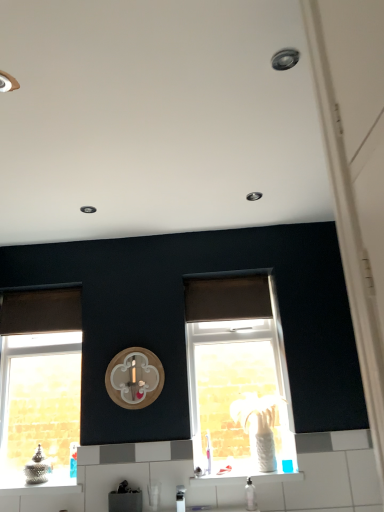
Locate an element on the screen. This screenshot has width=384, height=512. brown matte curtain at center, the 2th curtain from the left is located at coordinates (226, 297).

Describe the element at coordinates (40, 310) in the screenshot. The height and width of the screenshot is (512, 384). I see `brown fabric curtain at left, the first curtain viewed from the left` at that location.

What do you see at coordinates (238, 377) in the screenshot?
I see `translucent glass window at center, the 2th window viewed from the left` at bounding box center [238, 377].

Looking at this image, how much space does translucent glass window at center, acting as the 1th window starting from the right, occupy horizontally?

2.59 inches.

What is the approximate width of white glossy tile at lower center?

The width of white glossy tile at lower center is 8.98 inches.

Locate an element on the screen. The width and height of the screenshot is (384, 512). satin silver faucet at lower center is located at coordinates (180, 498).

From the image's perspective, relative to clear glass window at left, the first window from the left, is translucent glass window at center, acting as the 1th window starting from the right, above or below?

From the image's perspective, translucent glass window at center, acting as the 1th window starting from the right, appears above clear glass window at left, the first window from the left.

Looking at this image, which is correct: translucent glass window at center, acting as the 1th window starting from the right, is inside clear glass window at left, the first window from the left, or outside of it?

translucent glass window at center, acting as the 1th window starting from the right, lies outside clear glass window at left, the first window from the left.

From the picture: In the image, is clear glass window at left, the first window from the left, positioned in front of or behind brown fabric curtain at left, the second curtain from the right?

clear glass window at left, the first window from the left, is in front of brown fabric curtain at left, the second curtain from the right.

Considering the relative sizes of clear glass window at left, the first window from the left, and brown fabric curtain at left, the first curtain viewed from the left, in the image provided, is clear glass window at left, the first window from the left, wider than brown fabric curtain at left, the first curtain viewed from the left,?

Indeed, clear glass window at left, the first window from the left, has a greater width compared to brown fabric curtain at left, the first curtain viewed from the left.

From a real-world perspective, is clear glass window at left, the first window from the left, on top of brown fabric curtain at left, the first curtain viewed from the left?

No, from a real-world perspective, clear glass window at left, the first window from the left, is not on top of brown fabric curtain at left, the first curtain viewed from the left.

Considering the points (19, 328) and (76, 320), which point is in front, point (19, 328) or point (76, 320)?

The point (76, 320) is closer.

Is wooden clock at center facing towards brown fabric curtain at left, the second curtain from the right?

No, wooden clock at center is not facing towards brown fabric curtain at left, the second curtain from the right.

From a real-world perspective, is wooden clock at center positioned under brown fabric curtain at left, the first curtain viewed from the left, based on gravity?

Yes, from a real-world perspective, wooden clock at center is under brown fabric curtain at left, the first curtain viewed from the left.

Which of these two, wooden clock at center or brown fabric curtain at left, the first curtain viewed from the left, is bigger?

With larger size is brown fabric curtain at left, the first curtain viewed from the left.

Is brown matte curtain at center, the 2th curtain from the left, inside or outside of wooden clock at center?

The correct answer is: outside.

Who is smaller, brown matte curtain at center, the first curtain positioned from the right, or wooden clock at center?

wooden clock at center.

From the picture: Can you confirm if brown matte curtain at center, the 2th curtain from the left, is taller than wooden clock at center?

No, brown matte curtain at center, the 2th curtain from the left, is not taller than wooden clock at center.

How distant is translucent glass window at center, acting as the 1th window starting from the right, from white glossy tile at lower center?

translucent glass window at center, acting as the 1th window starting from the right, is 26.07 inches away from white glossy tile at lower center.

In the scene shown: Can you tell me how much translucent glass window at center, the 2th window viewed from the left, and white glossy tile at lower center differ in facing direction?

There is a 0.00204-degree angle between the facing directions of translucent glass window at center, the 2th window viewed from the left, and white glossy tile at lower center.

Does translucent glass window at center, acting as the 1th window starting from the right, have a lesser height compared to white glossy tile at lower center?

In fact, translucent glass window at center, acting as the 1th window starting from the right, may be taller than white glossy tile at lower center.

Is translucent glass window at center, the 2th window viewed from the left, to the right of white glossy tile at lower center from the viewer's perspective?

No.

Does satin silver faucet at lower center have a greater width compared to brown matte curtain at center, the 2th curtain from the left?

Yes, satin silver faucet at lower center is wider than brown matte curtain at center, the 2th curtain from the left.

From the image's perspective, relative to brown matte curtain at center, the 2th curtain from the left, is satin silver faucet at lower center above or below?

From the image's perspective, satin silver faucet at lower center appears below brown matte curtain at center, the 2th curtain from the left.

You are a GUI agent. You are given a task and a screenshot of the screen. Output one action in this format:
    pyautogui.click(x=<x>, y=<y>)
    Task: Click on the appliance in front of the brown matte curtain at center, the 2th curtain from the left
    The height and width of the screenshot is (512, 384).
    Given the screenshot: What is the action you would take?
    pyautogui.click(x=180, y=498)

Which is behind, point (215, 317) or point (75, 291)?

Point (75, 291)

From the image's perspective, is brown matte curtain at center, the 2th curtain from the left, positioned above or below brown fabric curtain at left, the second curtain from the right?

Based on their image positions, brown matte curtain at center, the 2th curtain from the left, is located above brown fabric curtain at left, the second curtain from the right.

Which of these two, brown matte curtain at center, the 2th curtain from the left, or brown fabric curtain at left, the first curtain viewed from the left, is smaller?

brown fabric curtain at left, the first curtain viewed from the left, is smaller.

Locate an element on the screen. The image size is (384, 512). window on the right of clear glass window at left, the first window from the left is located at coordinates (238, 377).

You are a GUI agent. You are given a task and a screenshot of the screen. Output one action in this format:
    pyautogui.click(x=<x>, y=<y>)
    Task: Click on the 2nd curtain behind the clear glass window at left, the 2th window when ordered from right to left
    
    Given the screenshot: What is the action you would take?
    pyautogui.click(x=40, y=310)

Which object lies nearer to the anchor point satin silver faucet at lower center, brown fabric curtain at left, the second curtain from the right, or white glossy tile at lower center?

white glossy tile at lower center is closer to satin silver faucet at lower center.

Considering their positions, is brown matte curtain at center, the 2th curtain from the left, positioned further to clear glass window at left, the first window from the left, than brown fabric curtain at left, the second curtain from the right?

Among the two, brown matte curtain at center, the 2th curtain from the left, is located further to clear glass window at left, the first window from the left.

Based on their spatial positions, is satin silver faucet at lower center or wooden clock at center closer to clear glass window at left, the 2th window when ordered from right to left?

wooden clock at center lies closer to clear glass window at left, the 2th window when ordered from right to left, than the other object.

Based on their spatial positions, is brown fabric curtain at left, the second curtain from the right, or translucent glass window at center, acting as the 1th window starting from the right, closer to satin silver faucet at lower center?

Among the two, translucent glass window at center, acting as the 1th window starting from the right, is located nearer to satin silver faucet at lower center.

Based on the photo, based on their spatial positions, is translucent glass window at center, acting as the 1th window starting from the right, or satin silver faucet at lower center further from clear glass window at left, the 2th window when ordered from right to left?

satin silver faucet at lower center is further to clear glass window at left, the 2th window when ordered from right to left.

Estimate the real-world distances between objects in this image. Which object is closer to wooden clock at center, clear glass window at left, the 2th window when ordered from right to left, or translucent glass window at center, the 2th window viewed from the left?

Based on the image, clear glass window at left, the 2th window when ordered from right to left, appears to be nearer to wooden clock at center.

From the image, which object appears to be nearer to brown matte curtain at center, the 2th curtain from the left, white glossy tile at lower center or brown fabric curtain at left, the second curtain from the right?

brown fabric curtain at left, the second curtain from the right, lies closer to brown matte curtain at center, the 2th curtain from the left, than the other object.

From the image, which object appears to be farther from wooden clock at center, brown fabric curtain at left, the second curtain from the right, or white glossy tile at lower center?

white glossy tile at lower center is positioned further to the anchor wooden clock at center.

You are a GUI agent. You are given a task and a screenshot of the screen. Output one action in this format:
    pyautogui.click(x=<x>, y=<y>)
    Task: Click on the window sill between brown matte curtain at center, the 2th curtain from the left, and satin silver faucet at lower center in the up-down direction
    The image size is (384, 512).
    Given the screenshot: What is the action you would take?
    pyautogui.click(x=216, y=480)

You are a GUI agent. You are given a task and a screenshot of the screen. Output one action in this format:
    pyautogui.click(x=<x>, y=<y>)
    Task: Click on the window sill between translucent glass window at center, acting as the 1th window starting from the right, and satin silver faucet at lower center vertically
    This screenshot has height=512, width=384.
    Given the screenshot: What is the action you would take?
    pyautogui.click(x=216, y=480)

The width and height of the screenshot is (384, 512). Identify the location of clock located between brown fabric curtain at left, the second curtain from the right, and translucent glass window at center, the 2th window viewed from the left, in the left-right direction. (134, 378).

In order to click on clock located between clear glass window at left, the 2th window when ordered from right to left, and brown matte curtain at center, the first curtain positioned from the right, in the left-right direction in this screenshot , I will do `click(134, 378)`.